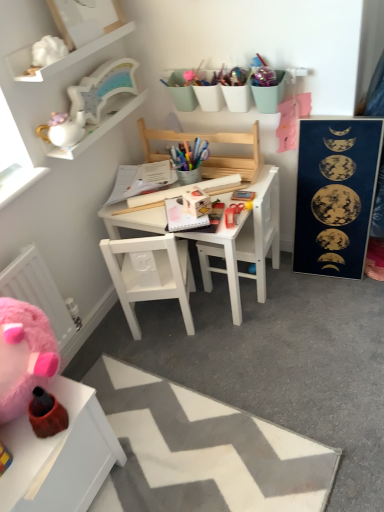
At what (x,y) coordinates should I click in order to perform the action: click on blank space situated above white matte cloud at upper left (from a real-world perspective). Please return your answer as a coordinate pair (x, y). This screenshot has width=384, height=512. Looking at the image, I should click on (71, 45).